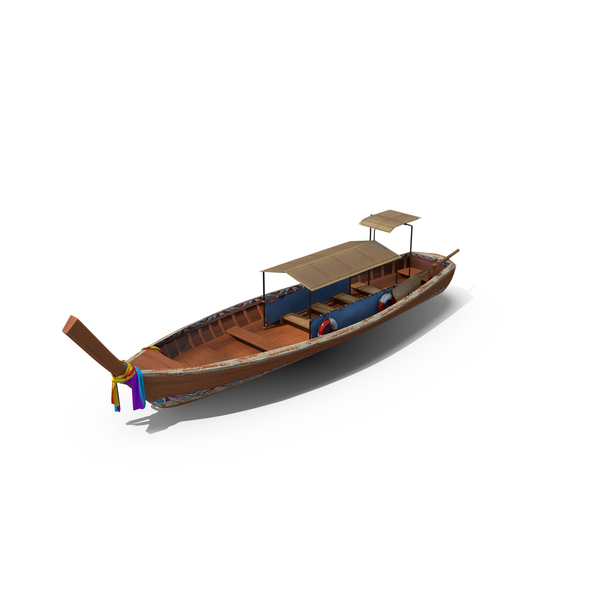
Identify the location of sash. (138, 391), (129, 370), (115, 395).